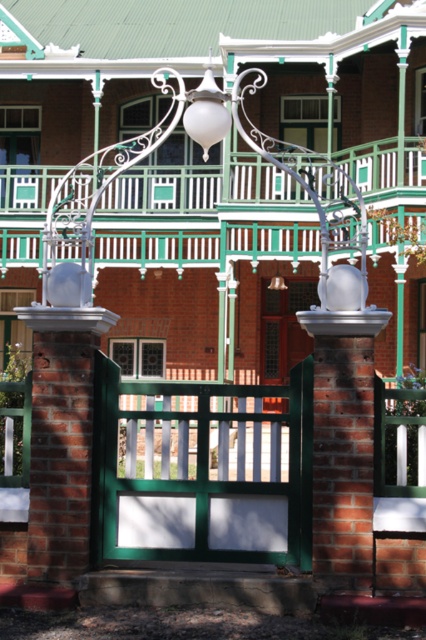
You are standing at the entrance of the historic building and want to take a photo of the gate. The camera you have can only focus on objects within 20 meters. Is the point at coordinates point (x=135, y=406) within the camera focus range?

The point point (x=135, y=406) is 24.71 meters from the camera, which is beyond the camera focus range of 20 meters. Therefore, the camera cannot focus on it.

Looking at this image, you are a painter who needs to decide which object to paint first between the green painted wood gate at center and the white matte lamp at upper center. Since you can only paint one at a time, which object requires more paint due to its size?

The green painted wood gate at center requires more paint because it is bigger than the white matte lamp at upper center.